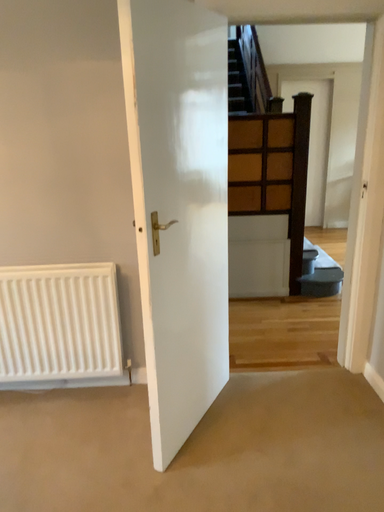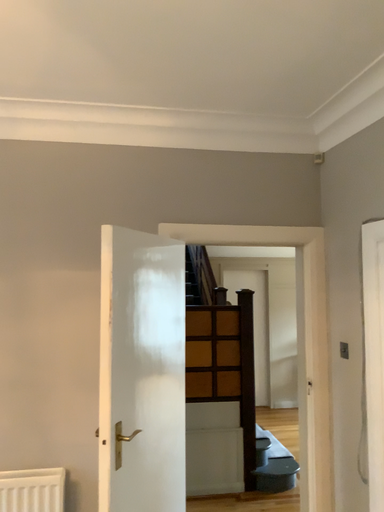
Question: How did the camera likely rotate when shooting the video?

Choices:
 (A) rotated upward
 (B) rotated downward

Answer: (A)